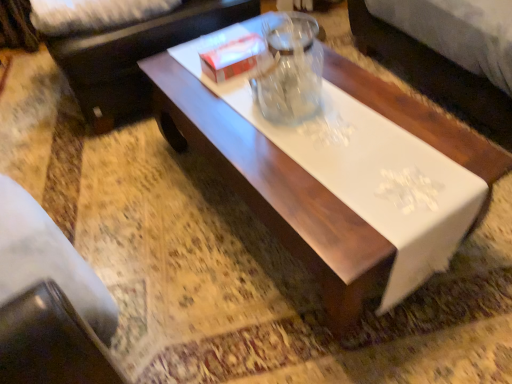
You are a GUI agent. You are given a task and a screenshot of the screen. Output one action in this format:
    pyautogui.click(x=<x>, y=<y>)
    Task: Click on the vacant space situated above white glossy coffee table at center (from a real-world perspective)
    Image resolution: width=512 pixels, height=384 pixels.
    Given the screenshot: What is the action you would take?
    pyautogui.click(x=322, y=130)